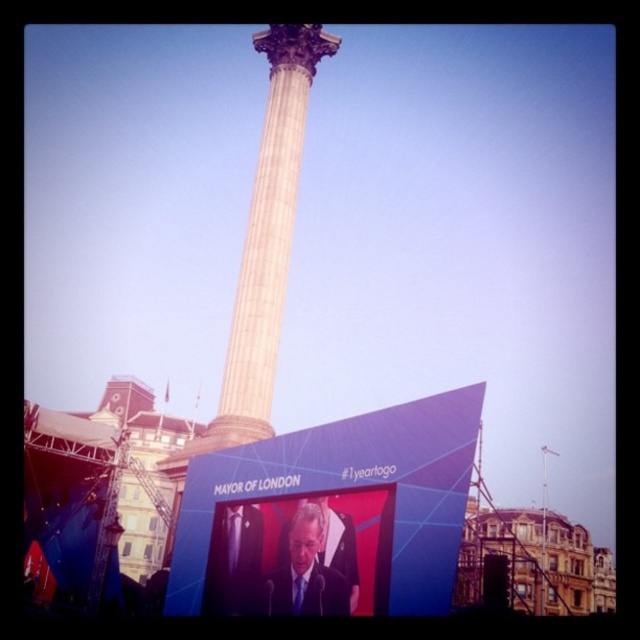
Question: Can you confirm if white marble column at center is thinner than dark suit at center?

Choices:
 (A) yes
 (B) no

Answer: (B)

Question: Which object is closer to the camera taking this photo?

Choices:
 (A) white marble column at center
 (B) dark suit at center

Answer: (B)

Question: Which of the following is the closest to the observer?

Choices:
 (A) dark suit at center
 (B) white marble column at center

Answer: (A)

Question: Can you confirm if white marble column at center is smaller than dark suit at center?

Choices:
 (A) no
 (B) yes

Answer: (A)

Question: Is white marble column at center smaller than dark suit at center?

Choices:
 (A) yes
 (B) no

Answer: (B)